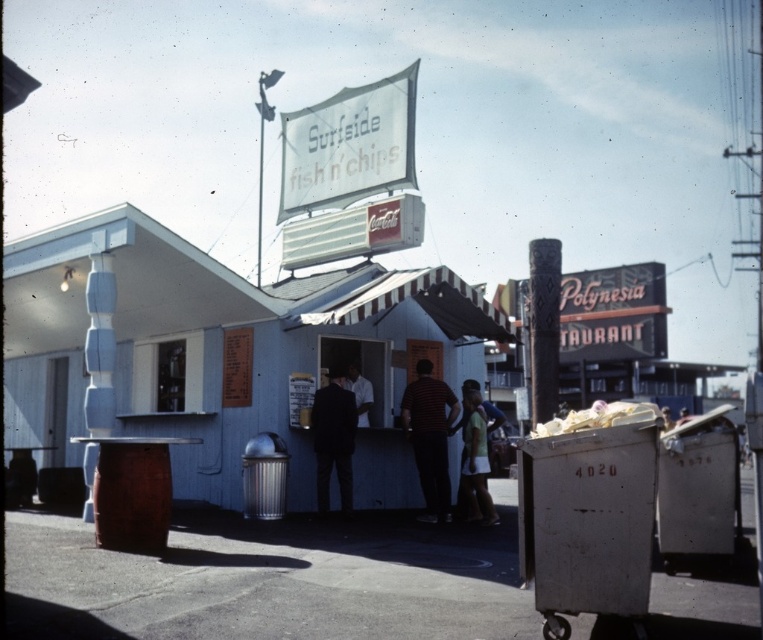
You are a customer at the Surfside Fish n Chips stand and you see two employees wearing a dark blue suit at center and a white matte shirt at center. Which employee is standing to the left side?

The dark blue suit at center is standing to the left of the white matte shirt at center, so the employee in the dark blue suit at center is on the left side.

You are a customer at the Surfside Fish n Chips stand and you want to order a meal. You notice two items on the menu board at the center of the stand. Which item has a larger size between the dark blue suit at center and the white matte shirt at center?

The dark blue suit at center is bigger than the white matte shirt at center, so the dark blue suit at center has a larger size.

You are a customer at the Surfside Fish n Chips stand and you see two people in front of you. One is wearing a striped shirt at center and the other a white matte shirt at center. Which shirt is positioned to the right?

The striped shirt at center is positioned to the right of the white matte shirt at center.